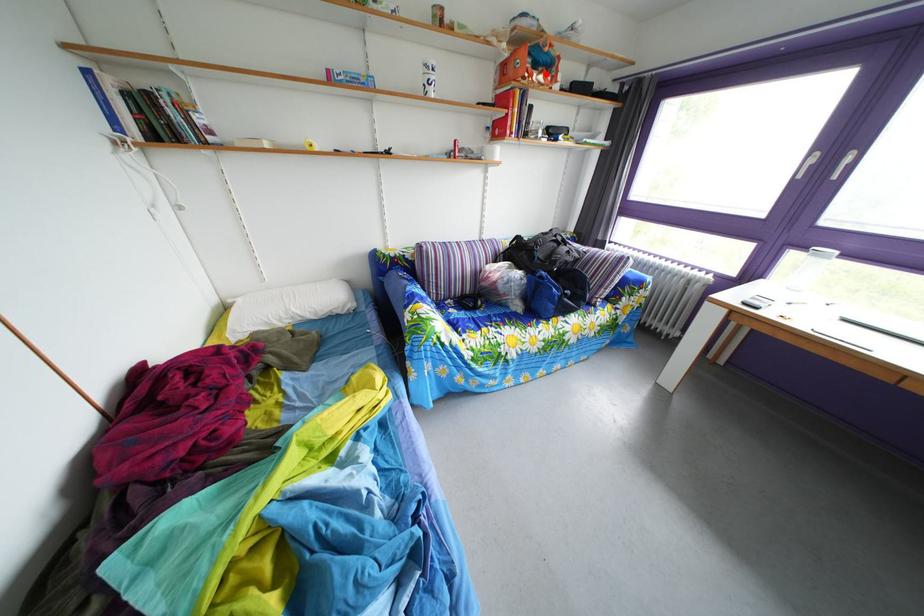
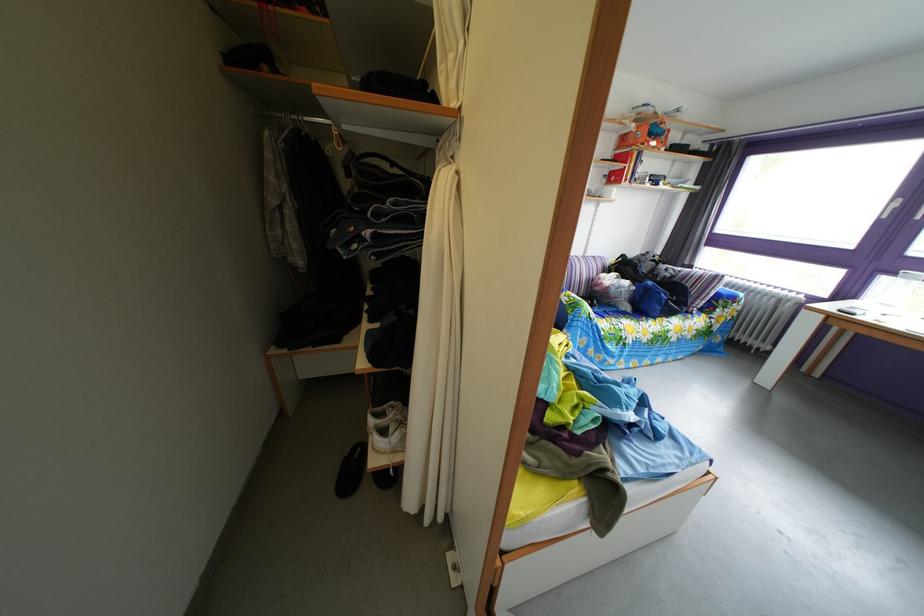
Locate, in the second image, the point that corresponds to the highlighted location in the first image.

(661, 144)